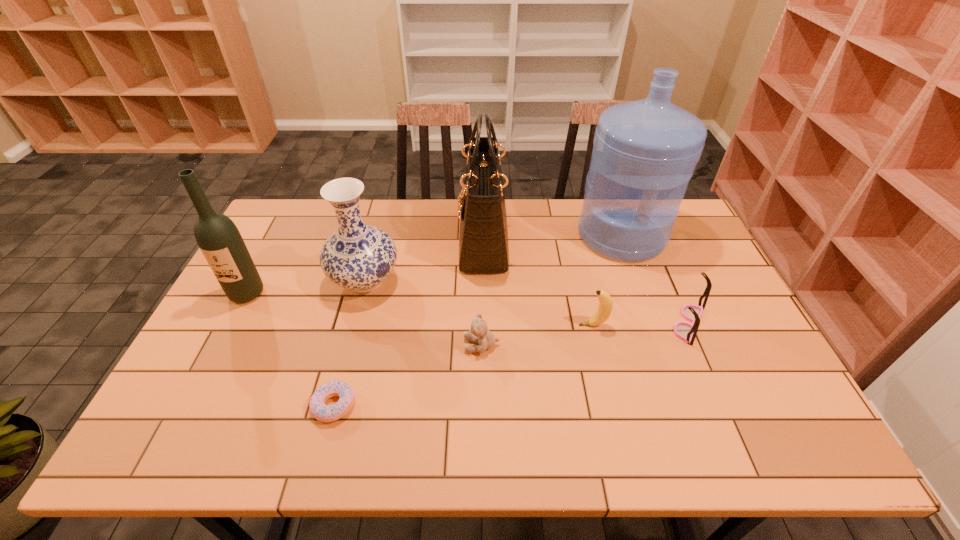
Where is `free spot between the tallest object and the seventh tallest object`? This screenshot has height=540, width=960. free spot between the tallest object and the seventh tallest object is located at coordinates (551, 290).

Identify the location of free space between the handbag and the doughnut. (409, 323).

Locate an element on the screen. Image resolution: width=960 pixels, height=540 pixels. free space between the tallest object and the banana is located at coordinates (608, 280).

Find the location of `vacant area that lies between the seventh tallest object and the nearest object`. vacant area that lies between the seventh tallest object and the nearest object is located at coordinates (408, 375).

At what (x,y) coordinates should I click in order to perform the action: click on object that is the seventh nearest to the tallest object. Please return your answer as a coordinate pair (x, y). Looking at the image, I should click on click(220, 241).

At what (x,y) coordinates should I click in order to perform the action: click on object that stands as the fifth closest to the fourth tallest object. Please return your answer as a coordinate pair (x, y). The width and height of the screenshot is (960, 540). Looking at the image, I should click on (605, 307).

Identify the location of free space in the image that satisfies the following two spatial constraints: 1. on the labeled side of the leftmost object; 2. on the right side of the nearest object. This screenshot has width=960, height=540. (188, 406).

Where is `free space that satisfies the following two spatial constraints: 1. on the side of the tallest object with the handle; 2. on the face of the teddy bear`? free space that satisfies the following two spatial constraints: 1. on the side of the tallest object with the handle; 2. on the face of the teddy bear is located at coordinates (661, 345).

Where is `vacant space that satisfies the following two spatial constraints: 1. on the side of the spectacles with the handle; 2. on the right side of the tallest object`? Image resolution: width=960 pixels, height=540 pixels. vacant space that satisfies the following two spatial constraints: 1. on the side of the spectacles with the handle; 2. on the right side of the tallest object is located at coordinates (654, 323).

The image size is (960, 540). I want to click on free spot that satisfies the following two spatial constraints: 1. on the side of the water jug with the handle; 2. on the face of the second shortest object, so click(x=661, y=345).